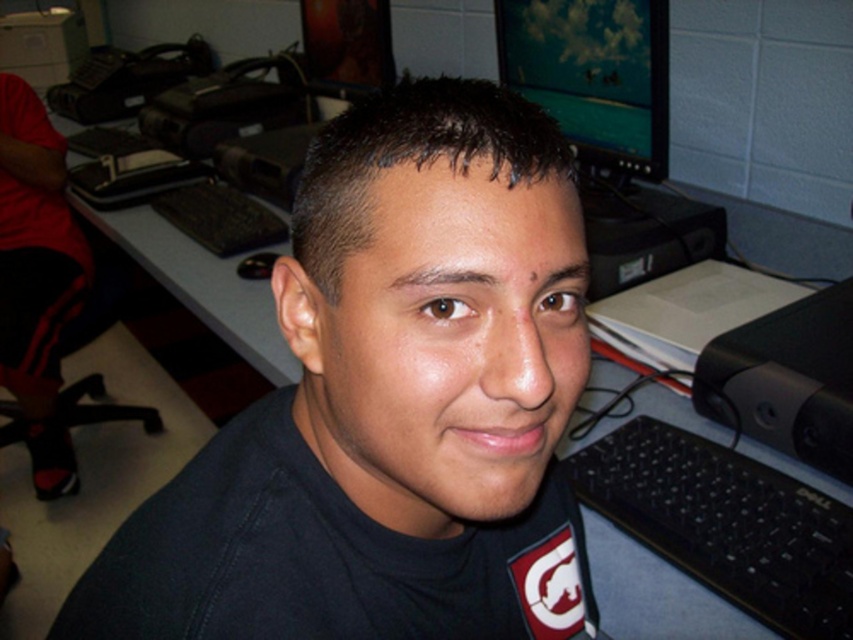
Does dark brown hair at center appear on the right side of brown hair at upper center?

Incorrect, dark brown hair at center is not on the right side of brown hair at upper center.

Can you confirm if dark brown hair at center is smaller than brown hair at upper center?

No.

Does point (318, 163) come farther from viewer compared to point (585, 275)?

Yes, point (318, 163) is behind point (585, 275).

The image size is (853, 640). Find the location of `dark brown hair at center`. dark brown hair at center is located at coordinates (415, 157).

How much distance is there between black plastic keyboard at lower right and dark brown hair at center?

The distance of black plastic keyboard at lower right from dark brown hair at center is 19.71 inches.

Is black plastic keyboard at lower right bigger than dark brown hair at center?

Yes.

This screenshot has width=853, height=640. Identify the location of black plastic keyboard at lower right. (724, 524).

The width and height of the screenshot is (853, 640). What do you see at coordinates (473, 218) in the screenshot?
I see `shiny dark hair at center` at bounding box center [473, 218].

Who is higher up, shiny dark hair at center or brown matte eyebrow at upper left?

shiny dark hair at center is higher up.

The image size is (853, 640). Describe the element at coordinates (473, 218) in the screenshot. I see `shiny dark hair at center` at that location.

The image size is (853, 640). What are the coordinates of `shiny dark hair at center` in the screenshot? It's located at (473, 218).